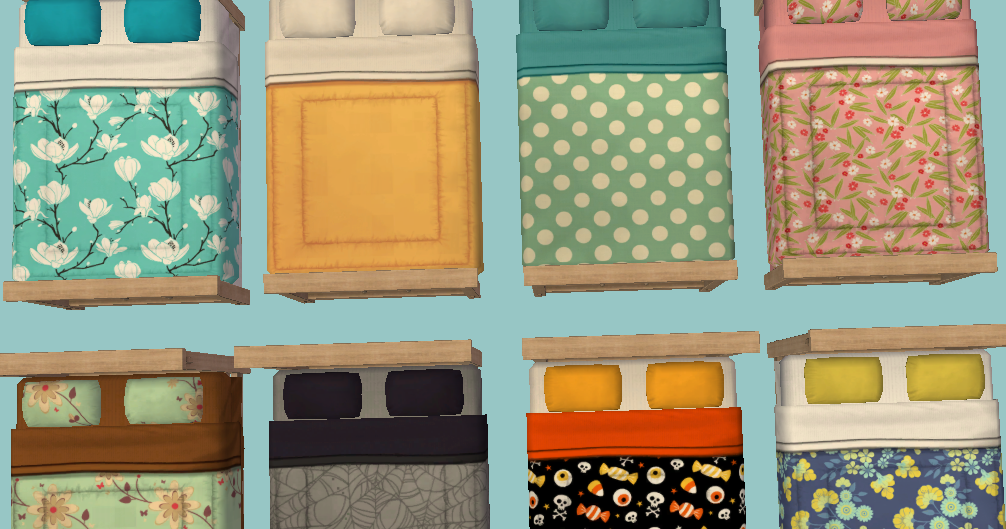
Identify the location of halloween comforter. (638, 510).